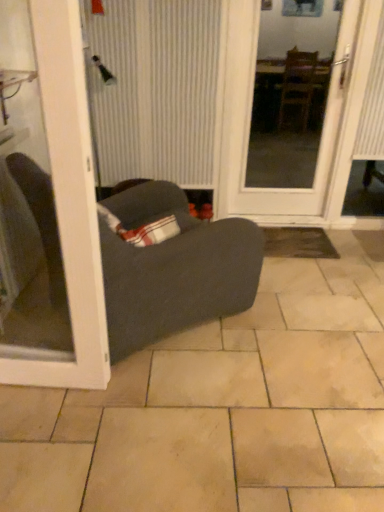
Question: Would you say white glossy door at center, which appears as the first door when viewed from the right, is inside or outside dark gray fabric studio couch at center?

Choices:
 (A) inside
 (B) outside

Answer: (B)

Question: Looking at the image, does white glossy door at center, the 1th door when ordered from back to front, seem bigger or smaller compared to dark gray fabric studio couch at center?

Choices:
 (A) small
 (B) big

Answer: (A)

Question: Estimate the real-world distances between objects in this image. Which object is farther from the white glossy door at left, which is counted as the second door, starting from the back?

Choices:
 (A) white striped curtain at center
 (B) dark gray fabric studio couch at center
 (C) beige ceramic tile at center
 (D) white glossy door at center, which appears as the first door when viewed from the right

Answer: (D)

Question: Estimate the real-world distances between objects in this image. Which object is closer to the white glossy door at left, acting as the 1th door starting from the front?

Choices:
 (A) white striped curtain at center
 (B) beige ceramic tile at center
 (C) white glossy door at center, the second door positioned from the left
 (D) dark gray fabric studio couch at center

Answer: (D)